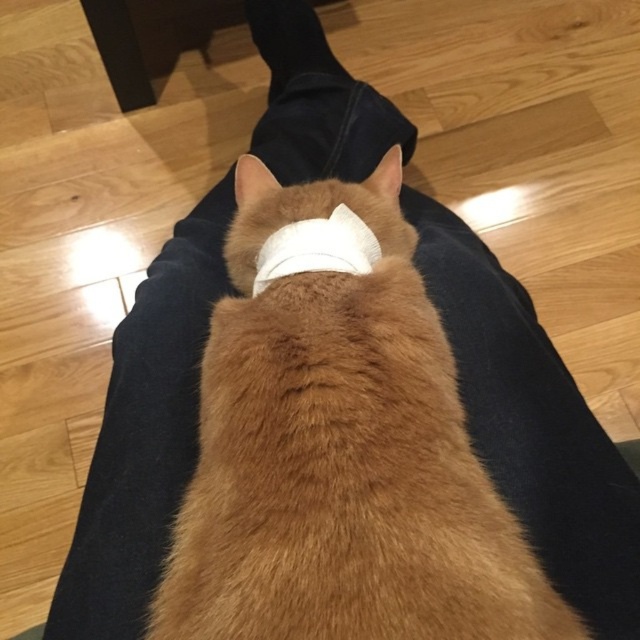
Does orange fur cat at center have a lesser width compared to white fabric bandage at center?

In fact, orange fur cat at center might be wider than white fabric bandage at center.

Is point (323, 356) closer to camera compared to point (353, 212)?

Yes, it is.

The width and height of the screenshot is (640, 640). Find the location of `orange fur cat at center`. orange fur cat at center is located at coordinates (340, 452).